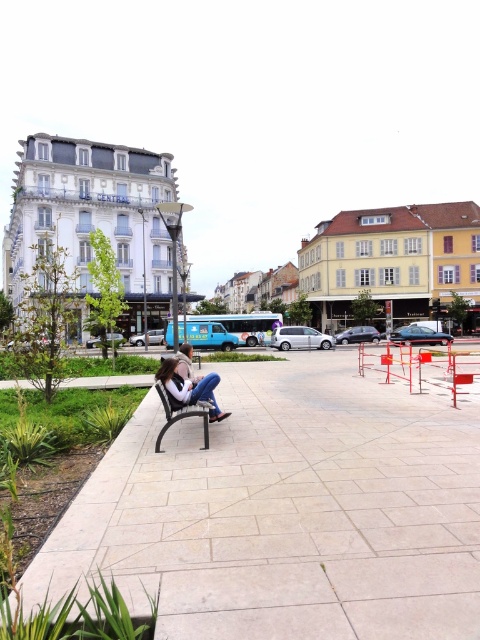
Question: Which point is closer to the camera?

Choices:
 (A) (165, 408)
 (B) (188, 374)

Answer: (A)

Question: Can you confirm if black plastic bench at center is positioned below denim jacket at center?

Choices:
 (A) yes
 (B) no

Answer: (A)

Question: Which of these objects is positioned farthest from the denim jacket at center?

Choices:
 (A) black plastic bench at center
 (B) light beige paving stone at center

Answer: (B)

Question: Considering the real-world distances, which object is closest to the black plastic bench at center?

Choices:
 (A) denim jeans at lower left
 (B) light beige paving stone at center
 (C) denim jacket at center

Answer: (A)

Question: Does light beige paving stone at center appear under black plastic bench at center?

Choices:
 (A) yes
 (B) no

Answer: (A)

Question: Does denim jeans at lower left have a greater width compared to black plastic bench at center?

Choices:
 (A) no
 (B) yes

Answer: (B)